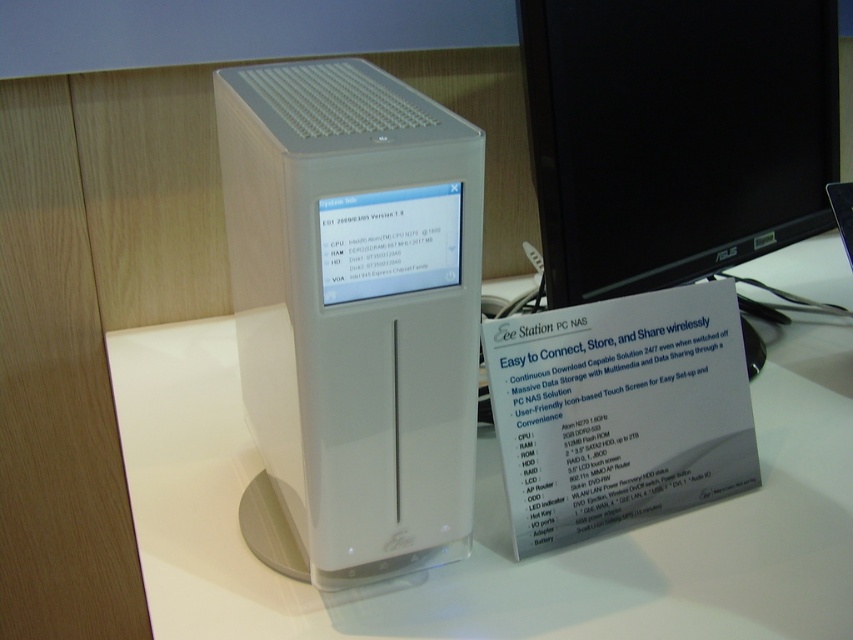
Which of these two, white plastic computer tower at center or black glossy monitor at upper right, stands shorter?

black glossy monitor at upper right

Who is higher up, white plastic computer tower at center or black glossy monitor at upper right?

black glossy monitor at upper right

From the picture: Who is more distant from viewer, (x=347, y=182) or (x=671, y=266)?

The point (x=671, y=266) is behind.

Locate an element on the screen. white plastic computer tower at center is located at coordinates (357, 307).

Can you confirm if white plastic computer desk at center is smaller than black glossy monitor at upper right?

Incorrect, white plastic computer desk at center is not smaller in size than black glossy monitor at upper right.

Is white plastic computer desk at center below black glossy monitor at upper right?

Yes, white plastic computer desk at center is below black glossy monitor at upper right.

Is point (173, 364) positioned before point (590, 246)?

That is False.

Locate an element on the screen. The height and width of the screenshot is (640, 853). white plastic computer desk at center is located at coordinates (494, 522).

Could you measure the distance between white plastic computer desk at center and white plastic computer tower at center?

10.46 inches

Does white plastic computer desk at center have a larger size compared to white plastic computer tower at center?

Yes, white plastic computer desk at center is bigger than white plastic computer tower at center.

Is point (480, 499) less distant than point (442, 275)?

That is False.

The width and height of the screenshot is (853, 640). I want to click on white plastic computer desk at center, so click(x=494, y=522).